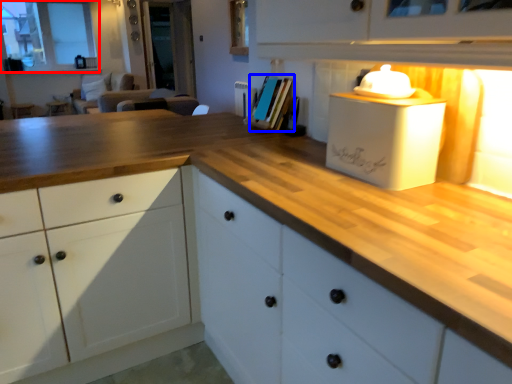
Question: Among these objects, which one is nearest to the camera, window (highlighted by a red box) or book (highlighted by a blue box)?

Choices:
 (A) window
 (B) book

Answer: (B)